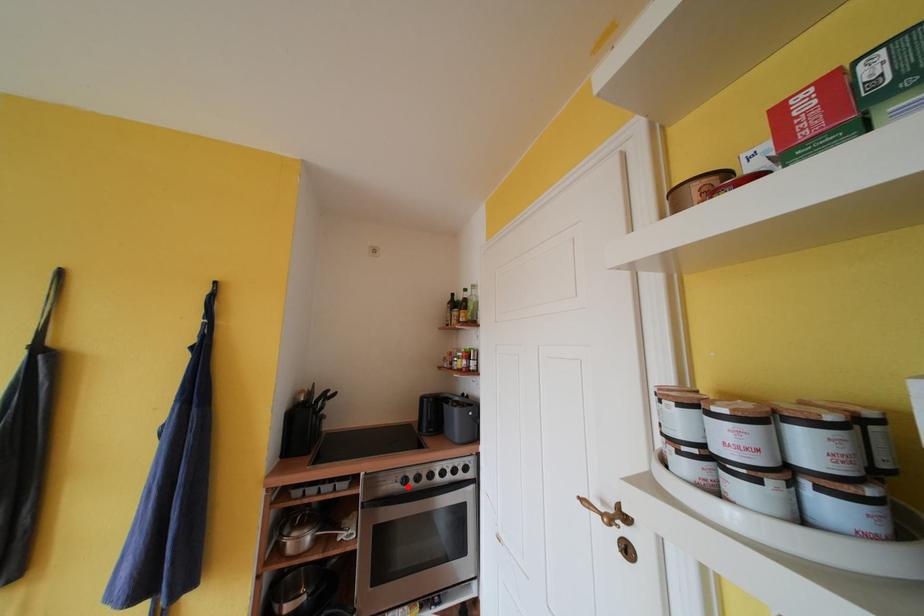
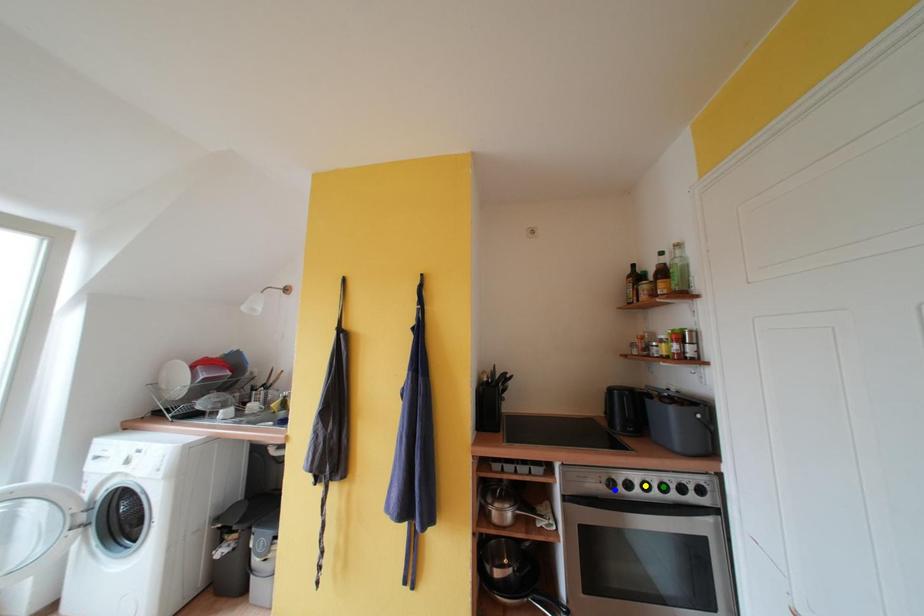
Question: I am providing you with two images of the same scene from different viewpoints. A red point is marked on the first image. You are given multiple points on the second image. Can you choose the point in image 2 that corresponds to the point in image 1?

Choices:
 (A) green point
 (B) yellow point
 (C) blue point

Answer: (C)